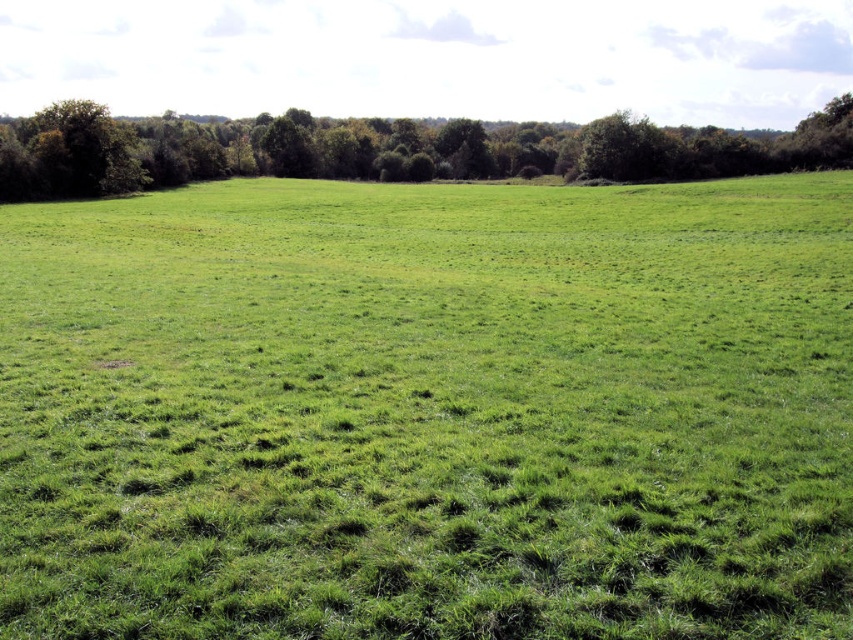
Does green grassy pasture at center come in front of green leafy trees at upper center?

That is True.

Which is more to the right, green grassy pasture at center or green leafy trees at upper center?

green leafy trees at upper center

Find the location of `green grassy pasture at center`. green grassy pasture at center is located at coordinates (428, 412).